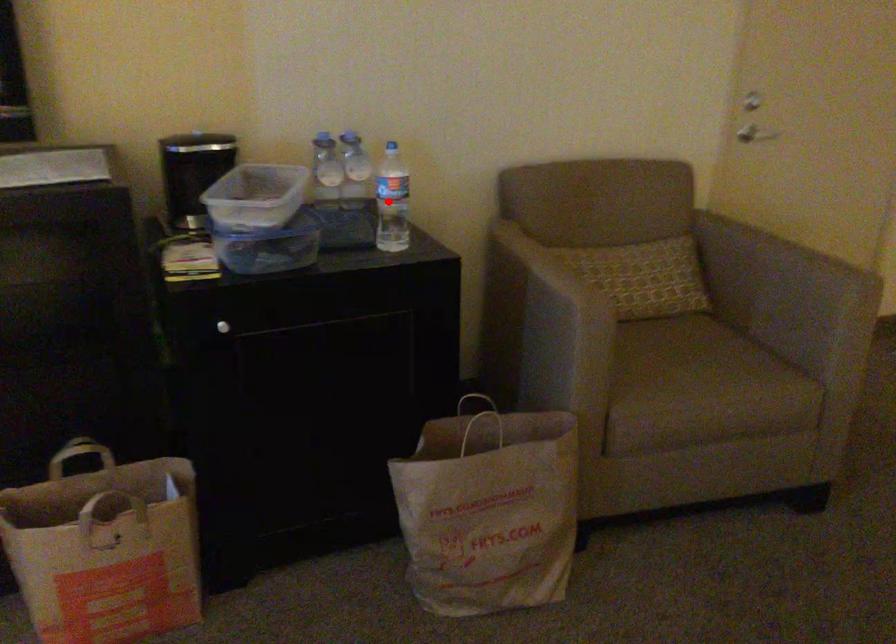
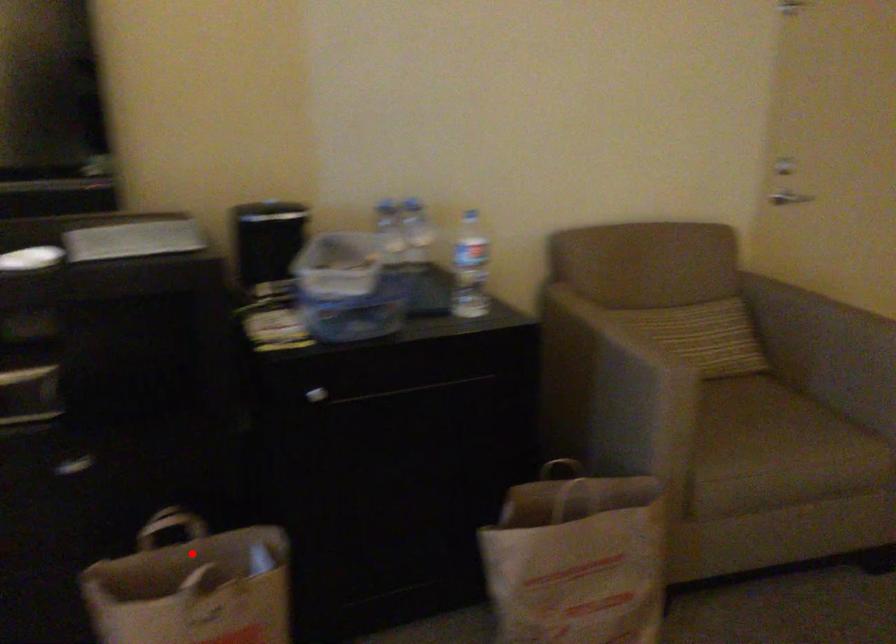
I am providing you with two images of the same scene from different viewpoints. A red point is marked on the first image and another point is marked on the second image. Does the point marked in image1 correspond to the same location as the one in image2?

No